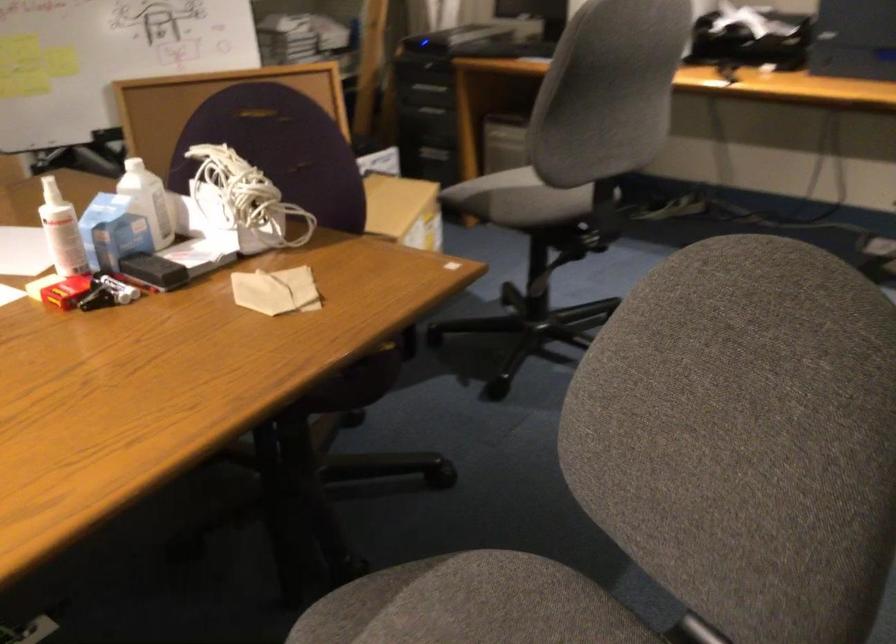
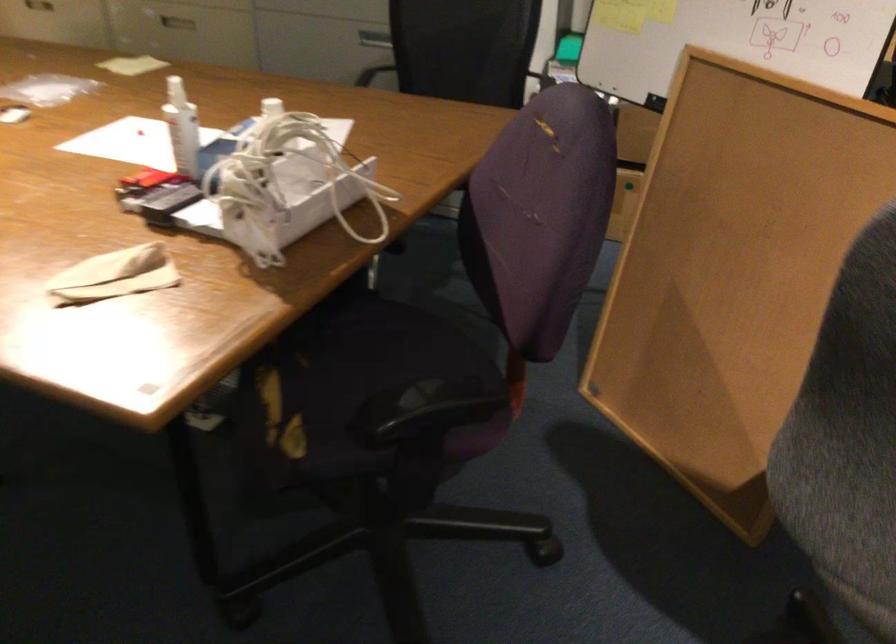
The point at (80,220) is marked in the first image. Where is the corresponding point in the second image?

(182, 128)